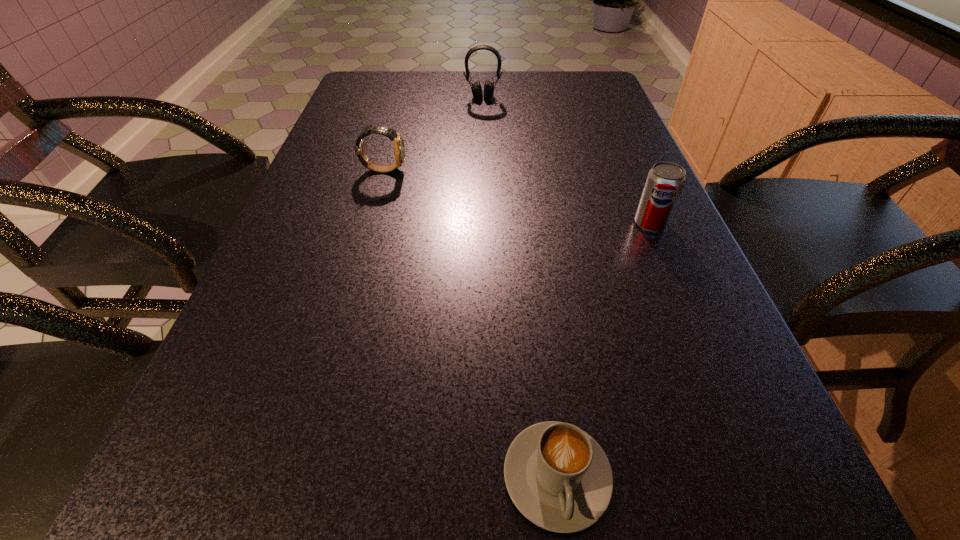
The width and height of the screenshot is (960, 540). Find the location of `the farthest object`. the farthest object is located at coordinates (476, 88).

Locate an element on the screen. the second nearest object is located at coordinates (665, 181).

This screenshot has height=540, width=960. I want to click on the rightmost object, so click(x=665, y=181).

Locate an element on the screen. the leftmost object is located at coordinates (399, 149).

Locate an element on the screen. watch is located at coordinates (399, 149).

I want to click on the shortest object, so click(x=559, y=478).

This screenshot has width=960, height=540. Identify the location of cappuccino. (559, 478).

You are a GUI agent. You are given a task and a screenshot of the screen. Output one action in this format:
    pyautogui.click(x=<x>, y=<y>)
    Task: Click on the vacant region located 0.360m on the front-facing side of the farthest object
    
    Given the screenshot: What is the action you would take?
    pyautogui.click(x=484, y=169)

The height and width of the screenshot is (540, 960). What are the coordinates of `free region located 0.340m on the front of the soda` in the screenshot? It's located at (722, 392).

I want to click on vacant space located on the face of the second farthest object, so click(518, 170).